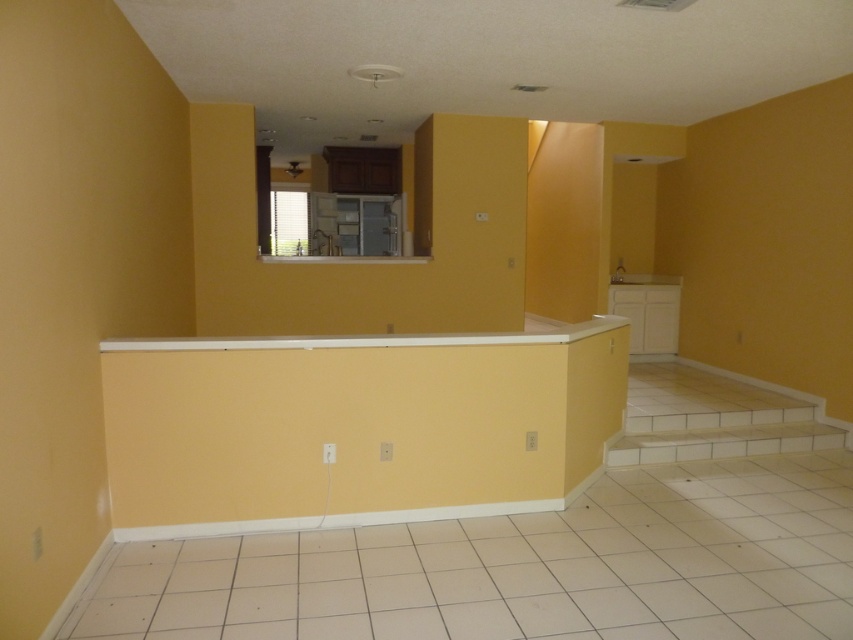
You are moving a 4 feet wide painting and need to place it between the white smooth trim at center and the white tile stairs at lower right. Will there be enough space?

The distance between the white smooth trim at center and the white tile stairs at lower right is 4.23 feet. Since the painting is 4 feet wide, there is enough space to place it between them as 4.23 feet is greater than 4 feet.

You are planning to place a decorative item on the white smooth trim at center and the white tile stairs at lower right. Given their sizes, which surface can accommodate a larger decorative item?

The white smooth trim at center is bigger than the white tile stairs at lower right, so it can accommodate a larger decorative item.

You are standing in the kitchen and see two points marked on the wall. The first point is at coordinates point (567, 470) and the second is at point (782, 433). Which point is closer to you?

Point (567, 470) is in front of point (782, 433), so it is closer to you.